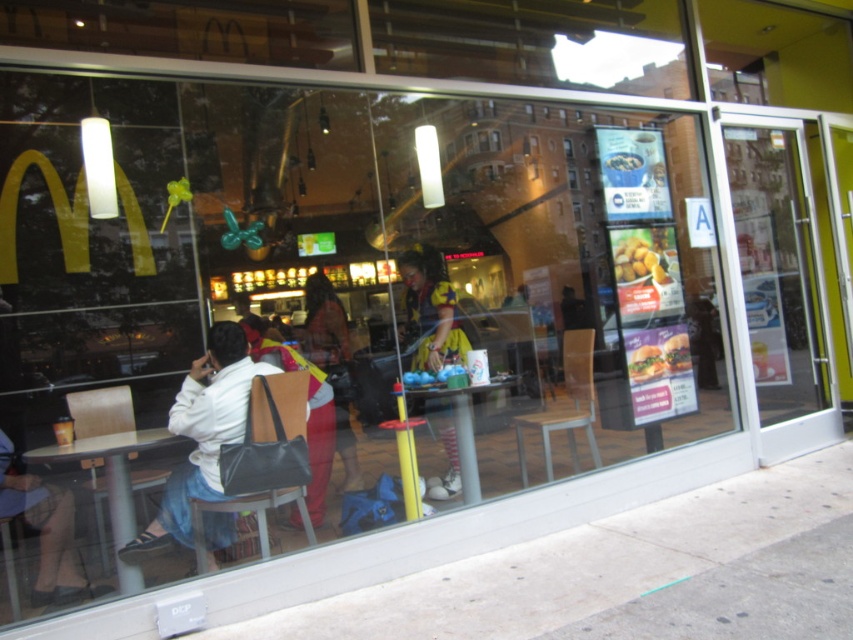
You are standing at the entrance of the McDonalds restaurant and want to reach the counter area. You see two points marked as point [323,620] and point [445,474]. Which point should you walk towards to get to the counter area first?

Point [323,620] is in front of point [445,474], so you should walk towards point [323,620] first to reach the counter area.